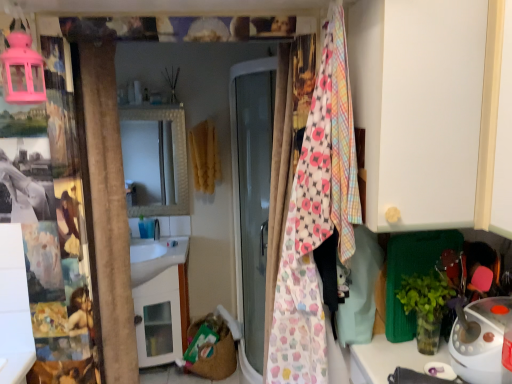
Question: Is white plastic iron at lower right oriented away from cupcake-patterned fabric at center?

Choices:
 (A) no
 (B) yes

Answer: (A)

Question: Is cupcake-patterned fabric at center a part of white plastic iron at lower right?

Choices:
 (A) no
 (B) yes

Answer: (A)

Question: Does white plastic iron at lower right lie behind cupcake-patterned fabric at center?

Choices:
 (A) yes
 (B) no

Answer: (A)

Question: From a real-world perspective, is white plastic iron at lower right located beneath cupcake-patterned fabric at center?

Choices:
 (A) yes
 (B) no

Answer: (A)

Question: Is white plastic iron at lower right in contact with cupcake-patterned fabric at center?

Choices:
 (A) no
 (B) yes

Answer: (A)

Question: Can you confirm if white plastic iron at lower right is positioned to the right of cupcake-patterned fabric at center?

Choices:
 (A) yes
 (B) no

Answer: (A)

Question: Can you confirm if cupcake-patterned fabric at center is smaller than white plastic iron at lower right?

Choices:
 (A) no
 (B) yes

Answer: (A)

Question: From a real-world perspective, is cupcake-patterned fabric at center physically above white plastic iron at lower right?

Choices:
 (A) no
 (B) yes

Answer: (B)

Question: Would you consider cupcake-patterned fabric at center to be distant from white plastic iron at lower right?

Choices:
 (A) yes
 (B) no

Answer: (B)

Question: Does cupcake-patterned fabric at center appear on the left side of white plastic iron at lower right?

Choices:
 (A) no
 (B) yes

Answer: (B)

Question: Is white plastic iron at lower right at the back of cupcake-patterned fabric at center?

Choices:
 (A) no
 (B) yes

Answer: (A)

Question: Is cupcake-patterned fabric at center closer to camera compared to white plastic iron at lower right?

Choices:
 (A) no
 (B) yes

Answer: (B)

Question: From the image's perspective, is cupcake-patterned fabric at center above or below white plastic iron at lower right?

Choices:
 (A) above
 (B) below

Answer: (A)